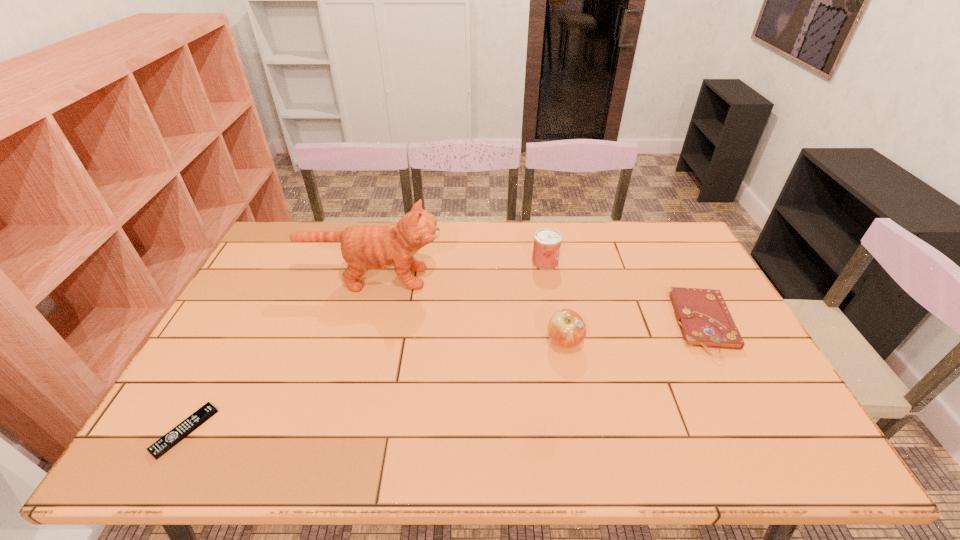
At what (x,y) coordinates should I click in order to perform the action: click on free space located 0.370m on the left of the apple. Please return your answer as a coordinate pair (x, y). Image resolution: width=960 pixels, height=540 pixels. Looking at the image, I should click on (414, 342).

I want to click on blank area located 0.220m on the front of the fourth tallest object, so click(763, 438).

This screenshot has width=960, height=540. I want to click on vacant space located on the back of the remote control, so click(221, 365).

Where is `object at the far edge`? object at the far edge is located at coordinates (547, 242).

Where is `object situated at the near edge`? object situated at the near edge is located at coordinates (164, 444).

This screenshot has width=960, height=540. In order to click on object located in the left edge section of the desktop in this screenshot , I will do 164,444.

I want to click on object located in the right edge section of the desktop, so click(x=704, y=319).

Where is `object that is positioned at the near left corner`? object that is positioned at the near left corner is located at coordinates (164, 444).

The width and height of the screenshot is (960, 540). I want to click on vacant space at the far edge of the desktop, so click(x=632, y=235).

In the image, there is a desktop. What are the coordinates of `free space at the left edge` in the screenshot? It's located at (x=228, y=316).